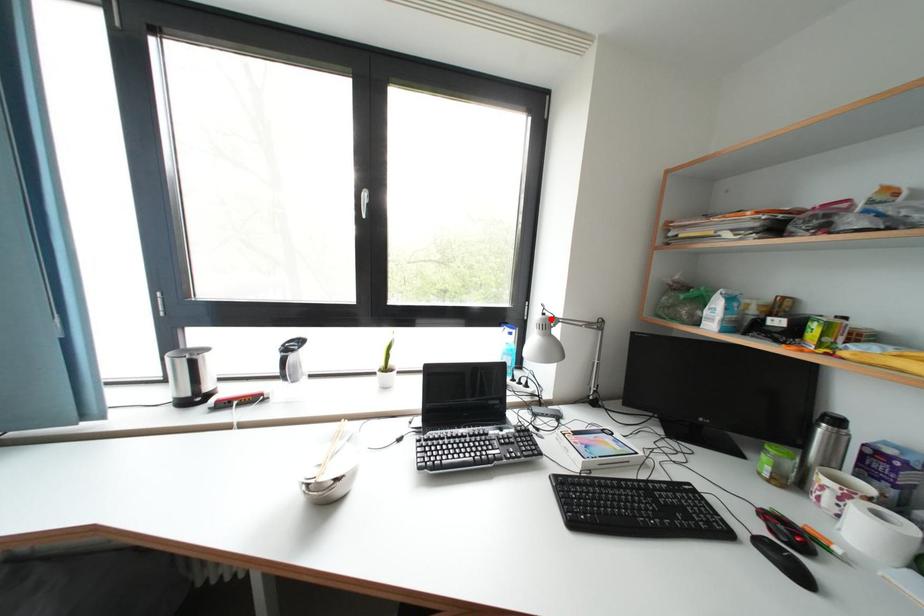
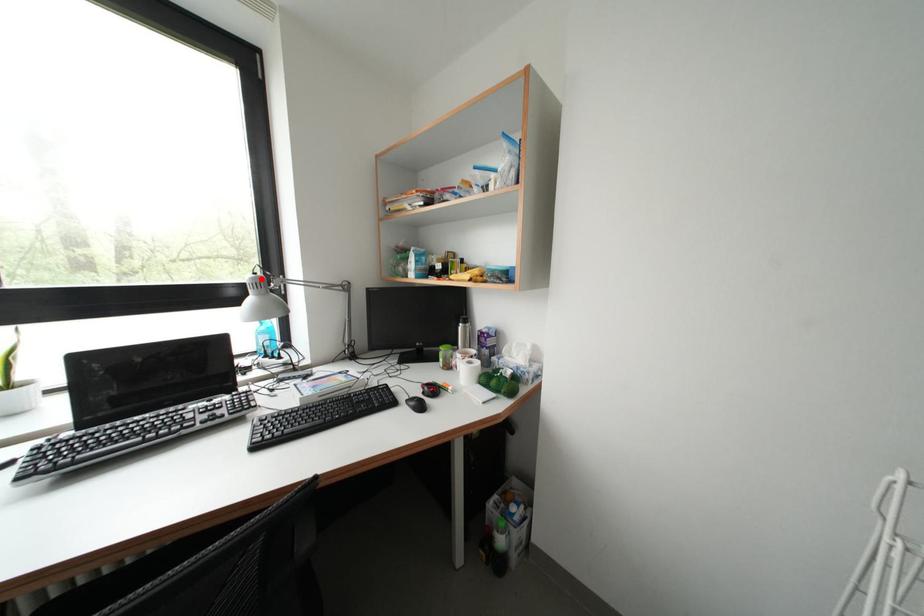
I am providing you with two images of the same scene from different viewpoints. A red point is marked on the first image and another point is marked on the second image. Is the red point in image1 aligned with the point shown in image2?

Yes